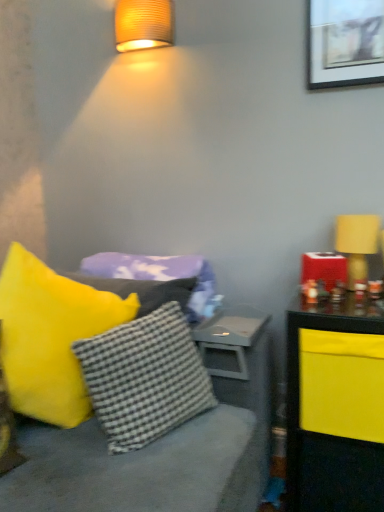
Question: Is checkered fabric pillow at center, which ranks as the 2th pillow in back-to-front order, turned away from yellow fabric lampshade at right?

Choices:
 (A) yes
 (B) no

Answer: (B)

Question: Is checkered fabric pillow at center, which is the 2th pillow in front-to-back order, smaller than yellow fabric lampshade at right?

Choices:
 (A) yes
 (B) no

Answer: (B)

Question: Considering the relative positions of checkered fabric pillow at center, which is the 2th pillow in front-to-back order, and yellow fabric lampshade at right in the image provided, is checkered fabric pillow at center, which is the 2th pillow in front-to-back order, in front of yellow fabric lampshade at right?

Choices:
 (A) yes
 (B) no

Answer: (A)

Question: From a real-world perspective, does checkered fabric pillow at center, which is the 2th pillow in front-to-back order, stand above yellow fabric lampshade at right?

Choices:
 (A) no
 (B) yes

Answer: (A)

Question: Considering the relative sizes of checkered fabric pillow at center, which ranks as the 2th pillow in back-to-front order, and yellow fabric lampshade at right in the image provided, is checkered fabric pillow at center, which ranks as the 2th pillow in back-to-front order, taller than yellow fabric lampshade at right?

Choices:
 (A) no
 (B) yes

Answer: (B)

Question: Is yellow fabric pillow at left, which is the first pillow from front to back, inside the boundaries of soft purple pillow at center, placed as the first pillow when sorted from back to front, or outside?

Choices:
 (A) inside
 (B) outside

Answer: (B)

Question: Looking at the image, does yellow fabric pillow at left, which is counted as the 3th pillow, starting from the back, seem bigger or smaller compared to soft purple pillow at center, the 3th pillow from the front?

Choices:
 (A) big
 (B) small

Answer: (A)

Question: Does point (69, 373) appear closer or farther from the camera than point (153, 276)?

Choices:
 (A) closer
 (B) farther

Answer: (A)

Question: Would you say yellow fabric pillow at left, which is counted as the 3th pillow, starting from the back, is to the left or to the right of soft purple pillow at center, placed as the first pillow when sorted from back to front, in the picture?

Choices:
 (A) right
 (B) left

Answer: (B)

Question: Looking at their shapes, would you say yellow fabric pillow at left, which is counted as the 3th pillow, starting from the back, is wider or thinner than matte ribbed lampshade at upper left?

Choices:
 (A) thin
 (B) wide

Answer: (B)

Question: From the image's perspective, is yellow fabric pillow at left, which is the first pillow from front to back, positioned above or below matte ribbed lampshade at upper left?

Choices:
 (A) above
 (B) below

Answer: (B)

Question: In terms of size, does yellow fabric pillow at left, which is counted as the 3th pillow, starting from the back, appear bigger or smaller than matte ribbed lampshade at upper left?

Choices:
 (A) big
 (B) small

Answer: (A)

Question: Does point (79, 417) appear closer or farther from the camera than point (137, 29)?

Choices:
 (A) closer
 (B) farther

Answer: (A)

Question: In terms of height, does yellow fabric pillow at left, which is counted as the 3th pillow, starting from the back, look taller or shorter compared to yellow fabric lampshade at right?

Choices:
 (A) tall
 (B) short

Answer: (A)

Question: In the image, is yellow fabric pillow at left, which is the first pillow from front to back, positioned in front of or behind yellow fabric lampshade at right?

Choices:
 (A) behind
 (B) front

Answer: (B)